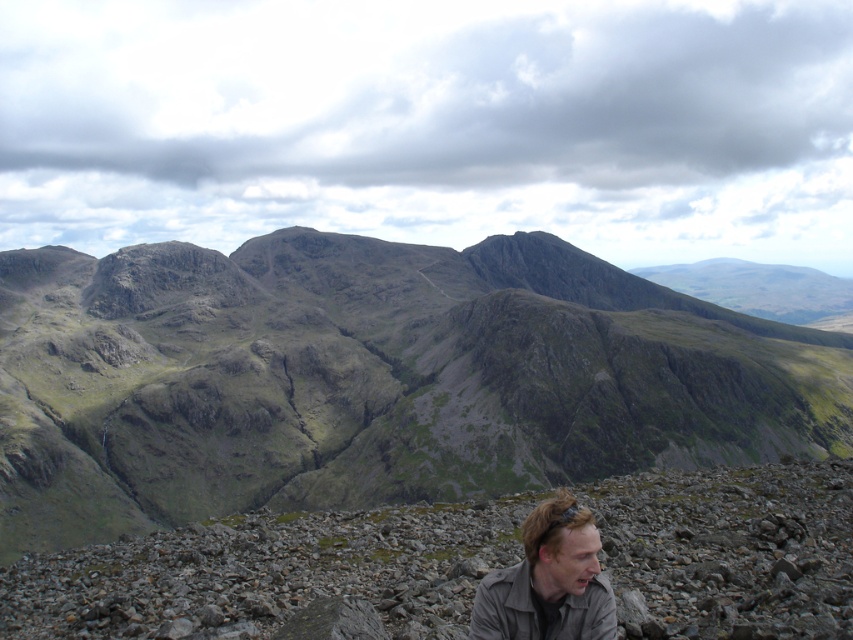
Between gray gravelly rocks at lower right and light brown leather jacket at lower center, which one has less height?

With less height is light brown leather jacket at lower center.

Is gray gravelly rocks at lower right taller than light brown leather jacket at lower center?

Indeed, gray gravelly rocks at lower right has a greater height compared to light brown leather jacket at lower center.

Is point (479, 538) closer to viewer compared to point (485, 596)?

No, (479, 538) is behind (485, 596).

What are the coordinates of `gray gravelly rocks at lower right` in the screenshot? It's located at (271, 573).

Locate an element on the screen. The width and height of the screenshot is (853, 640). rugged stone mountain at center is located at coordinates (370, 378).

Is rugged stone mountain at center thinner than light brown leather jacket at lower center?

No.

What do you see at coordinates (370, 378) in the screenshot? I see `rugged stone mountain at center` at bounding box center [370, 378].

You are a GUI agent. You are given a task and a screenshot of the screen. Output one action in this format:
    pyautogui.click(x=<x>, y=<y>)
    Task: Click on the rugged stone mountain at center
    Image resolution: width=853 pixels, height=640 pixels.
    Given the screenshot: What is the action you would take?
    pyautogui.click(x=370, y=378)

From the picture: Can you confirm if rugged stone mountain at center is positioned above gray gravelly rocks at lower right?

Indeed, rugged stone mountain at center is positioned over gray gravelly rocks at lower right.

Between rugged stone mountain at center and gray gravelly rocks at lower right, which one appears on the left side from the viewer's perspective?

Positioned to the left is rugged stone mountain at center.

Identify the location of rugged stone mountain at center. click(370, 378).